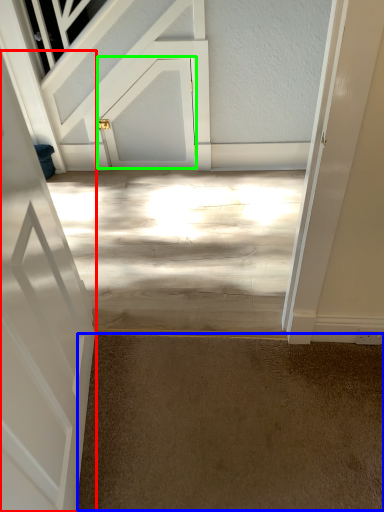
Question: Which is nearer to the door (highlighted by a red box)? concrete (highlighted by a blue box) or door (highlighted by a green box).

Choices:
 (A) concrete
 (B) door

Answer: (A)